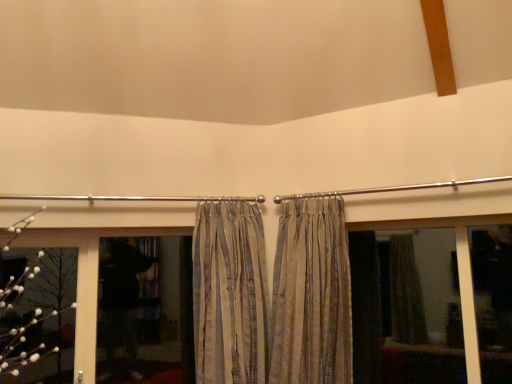
The image size is (512, 384). Describe the element at coordinates (274, 297) in the screenshot. I see `silky beige curtains at center, the first curtain in the right-to-left sequence` at that location.

At what (x,y) coordinates should I click in order to perform the action: click on dark glass window at lower left. Please return your answer as a coordinate pair (x, y). The height and width of the screenshot is (384, 512). Looking at the image, I should click on (88, 279).

Where is `matte glass window at center`? matte glass window at center is located at coordinates (458, 267).

Identify the location of white fluffy flower at left. (12, 308).

In order to face white fluffy flower at left, should I rotate leftwards or rightwards?

You should rotate left by 26.884 degrees.

You are a GUI agent. You are given a task and a screenshot of the screen. Output one action in this format:
    pyautogui.click(x=<x>, y=<y>)
    Task: Click on the striped fabric curtain at center, placed as the second curtain when sorted from right to left
    
    Given the screenshot: What is the action you would take?
    pyautogui.click(x=229, y=294)

Based on the photo, does black matte screen door at center have a greater width compared to striped fabric curtain at center, placed as the first curtain when sorted from left to right?

No, black matte screen door at center is not wider than striped fabric curtain at center, placed as the first curtain when sorted from left to right.

Considering the points (173, 257) and (260, 213), which point is in front, point (173, 257) or point (260, 213)?

The point (260, 213) is closer to the camera.

Is black matte screen door at center taller or shorter than striped fabric curtain at center, placed as the second curtain when sorted from right to left?

Considering their sizes, black matte screen door at center has less height than striped fabric curtain at center, placed as the second curtain when sorted from right to left.

Can you tell me how much black matte screen door at center and striped fabric curtain at center, placed as the second curtain when sorted from right to left, differ in facing direction?

The angle between the facing direction of black matte screen door at center and the facing direction of striped fabric curtain at center, placed as the second curtain when sorted from right to left, is 8.27 degrees.

Does striped fabric curtain at center, placed as the second curtain when sorted from right to left, turn towards silky beige curtains at center, the first curtain in the right-to-left sequence?

No, striped fabric curtain at center, placed as the second curtain when sorted from right to left, is not turned towards silky beige curtains at center, the first curtain in the right-to-left sequence.

How far apart are striped fabric curtain at center, placed as the first curtain when sorted from left to right, and silky beige curtains at center, the first curtain in the right-to-left sequence?

9.44 centimeters.

Does striped fabric curtain at center, placed as the second curtain when sorted from right to left, lie behind silky beige curtains at center, which is the second curtain from left to right?

No.

From a real-world perspective, is striped fabric curtain at center, placed as the second curtain when sorted from right to left, positioned over silky beige curtains at center, which is the second curtain from left to right, based on gravity?

Yes, from a real-world perspective, striped fabric curtain at center, placed as the second curtain when sorted from right to left, is above silky beige curtains at center, which is the second curtain from left to right.

From a real-world perspective, is silky beige curtains at center, the first curtain in the right-to-left sequence, physically located above or below striped fabric curtain at center, placed as the second curtain when sorted from right to left?

In terms of real-world spatial position, silky beige curtains at center, the first curtain in the right-to-left sequence, is below striped fabric curtain at center, placed as the second curtain when sorted from right to left.

Does silky beige curtains at center, which is the second curtain from left to right, appear on the left side of striped fabric curtain at center, placed as the first curtain when sorted from left to right?

Incorrect, silky beige curtains at center, which is the second curtain from left to right, is not on the left side of striped fabric curtain at center, placed as the first curtain when sorted from left to right.

From the image's perspective, which object appears higher, silky beige curtains at center, the first curtain in the right-to-left sequence, or striped fabric curtain at center, placed as the first curtain when sorted from left to right?

From the image's view, silky beige curtains at center, the first curtain in the right-to-left sequence, is above.

Would you say silky beige curtains at center, the first curtain in the right-to-left sequence, contains striped fabric curtain at center, placed as the first curtain when sorted from left to right?

Definitely not — striped fabric curtain at center, placed as the first curtain when sorted from left to right, is not inside silky beige curtains at center, the first curtain in the right-to-left sequence.

Which is in front, point (97, 272) or point (134, 359)?

The point (97, 272) is more forward.

Considering the relative sizes of dark glass window at lower left and black matte screen door at center in the image provided, is dark glass window at lower left smaller than black matte screen door at center?

Actually, dark glass window at lower left might be larger than black matte screen door at center.

Would you say dark glass window at lower left is a long distance from black matte screen door at center?

No, there isn't a large distance between dark glass window at lower left and black matte screen door at center.

Does dark glass window at lower left have a lesser height compared to black matte screen door at center?

In fact, dark glass window at lower left may be taller than black matte screen door at center.

Is point (164, 318) closer to viewer compared to point (431, 226)?

No, it is behind (431, 226).

From the image's perspective, is black matte screen door at center located above or below matte glass window at center?

Clearly, from the image's perspective, black matte screen door at center is below matte glass window at center.

Visually, is black matte screen door at center positioned to the left or to the right of matte glass window at center?

From the image, it's evident that black matte screen door at center is to the left of matte glass window at center.

Which of these two, black matte screen door at center or silky beige curtains at center, the first curtain in the right-to-left sequence, is smaller?

black matte screen door at center.

Is black matte screen door at center next to silky beige curtains at center, the first curtain in the right-to-left sequence, and touching it?

No, black matte screen door at center is not beside silky beige curtains at center, the first curtain in the right-to-left sequence.

From the image's perspective, is black matte screen door at center above silky beige curtains at center, the first curtain in the right-to-left sequence?

Incorrect, from the image's perspective, black matte screen door at center is lower than silky beige curtains at center, the first curtain in the right-to-left sequence.

Based on the photo, from the image's perspective, which one is positioned higher, white fluffy flower at left or striped fabric curtain at center, placed as the first curtain when sorted from left to right?

striped fabric curtain at center, placed as the first curtain when sorted from left to right, from the image's perspective.

How far apart are white fluffy flower at left and striped fabric curtain at center, placed as the second curtain when sorted from right to left?

They are 90.58 centimeters apart.

Which is in front, white fluffy flower at left or striped fabric curtain at center, placed as the second curtain when sorted from right to left?

Positioned in front is striped fabric curtain at center, placed as the second curtain when sorted from right to left.

The image size is (512, 384). Find the location of `screen door on the left of the striped fabric curtain at center, placed as the second curtain when sorted from right to left`. screen door on the left of the striped fabric curtain at center, placed as the second curtain when sorted from right to left is located at coordinates (145, 311).

You are a GUI agent. You are given a task and a screenshot of the screen. Output one action in this format:
    pyautogui.click(x=<x>, y=<y>)
    Task: Click on the curtain lying in front of the silky beige curtains at center, the first curtain in the right-to-left sequence
    The width and height of the screenshot is (512, 384).
    Given the screenshot: What is the action you would take?
    pyautogui.click(x=229, y=294)

Considering their positions, is white fluffy flower at left positioned closer to dark glass window at lower left than black matte screen door at center?

black matte screen door at center.

When comparing their distances from matte glass window at center, does silky beige curtains at center, which is the second curtain from left to right, or striped fabric curtain at center, placed as the first curtain when sorted from left to right, seem further?

striped fabric curtain at center, placed as the first curtain when sorted from left to right, lies further to matte glass window at center than the other object.

Based on their spatial positions, is striped fabric curtain at center, placed as the first curtain when sorted from left to right, or white fluffy flower at left closer to dark glass window at lower left?

striped fabric curtain at center, placed as the first curtain when sorted from left to right, is closer to dark glass window at lower left.

Considering their positions, is matte glass window at center positioned closer to black matte screen door at center than silky beige curtains at center, the first curtain in the right-to-left sequence?

Based on the image, silky beige curtains at center, the first curtain in the right-to-left sequence, appears to be nearer to black matte screen door at center.

From the image, which object appears to be nearer to white fluffy flower at left, dark glass window at lower left or black matte screen door at center?

Based on the image, dark glass window at lower left appears to be nearer to white fluffy flower at left.

Based on their spatial positions, is striped fabric curtain at center, placed as the first curtain when sorted from left to right, or silky beige curtains at center, the first curtain in the right-to-left sequence, further from dark glass window at lower left?

Among the two, silky beige curtains at center, the first curtain in the right-to-left sequence, is located further to dark glass window at lower left.

From the image, which object appears to be nearer to dark glass window at lower left, silky beige curtains at center, which is the second curtain from left to right, or matte glass window at center?

silky beige curtains at center, which is the second curtain from left to right, lies closer to dark glass window at lower left than the other object.

Looking at the image, which one is located closer to silky beige curtains at center, which is the second curtain from left to right, white fluffy flower at left or dark glass window at lower left?

dark glass window at lower left is closer to silky beige curtains at center, which is the second curtain from left to right.

Identify the location of curtain between striped fabric curtain at center, placed as the first curtain when sorted from left to right, and matte glass window at center. The image size is (512, 384). (274, 297).

I want to click on bay window located between white fluffy flower at left and black matte screen door at center in the left-right direction, so click(x=88, y=279).

Locate an element on the screen. This screenshot has height=384, width=512. screen door located between dark glass window at lower left and matte glass window at center in the left-right direction is located at coordinates (145, 311).

Identify the location of curtain between dark glass window at lower left and silky beige curtains at center, which is the second curtain from left to right, from left to right. pyautogui.click(x=229, y=294).